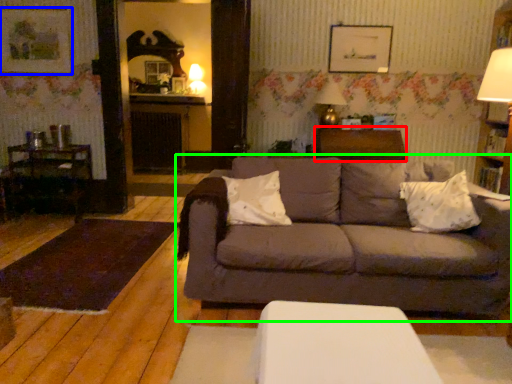
Question: Considering the real-world distances, which object is farthest from table (highlighted by a red box)? picture frame (highlighted by a blue box) or studio couch (highlighted by a green box)?

Choices:
 (A) picture frame
 (B) studio couch

Answer: (A)